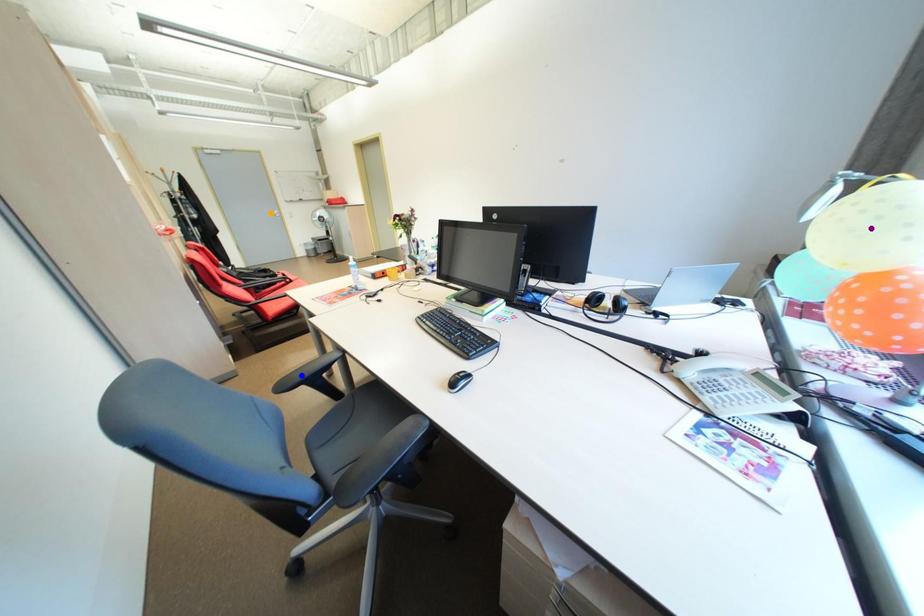
Order these from nearest to farthest:
A) purple point
B) orange point
C) blue point

purple point → blue point → orange point